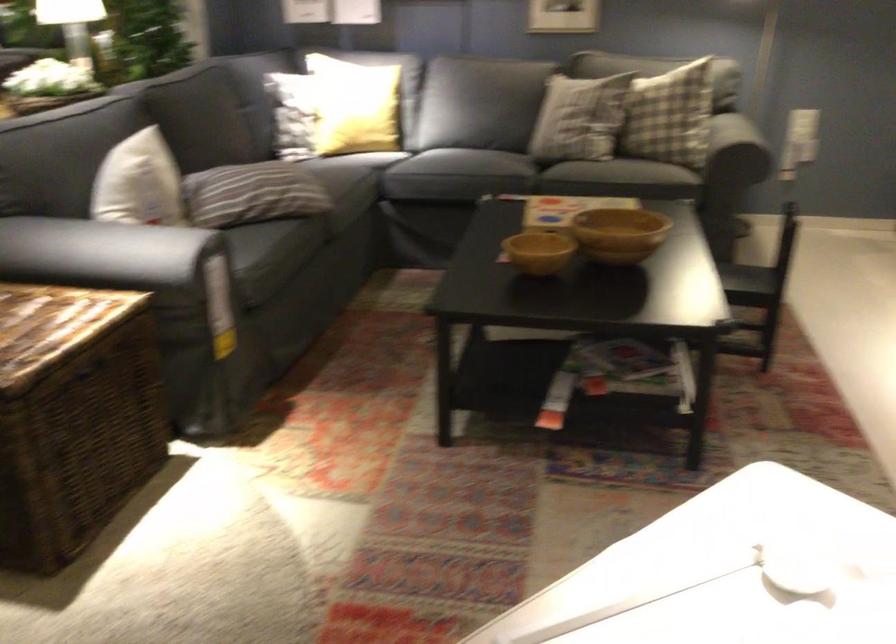
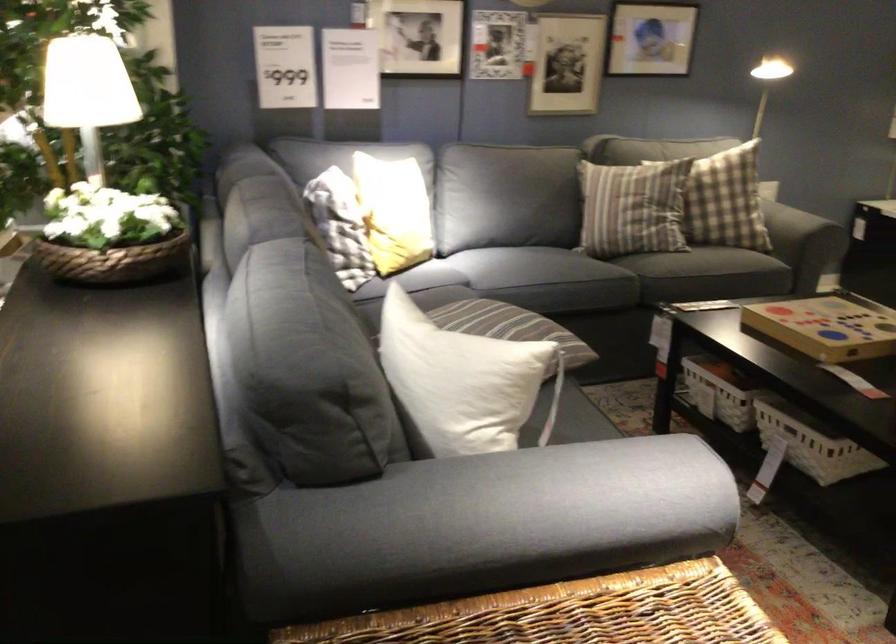
Where in the second image is the point corresponding to (297,96) from the first image?

(392, 212)